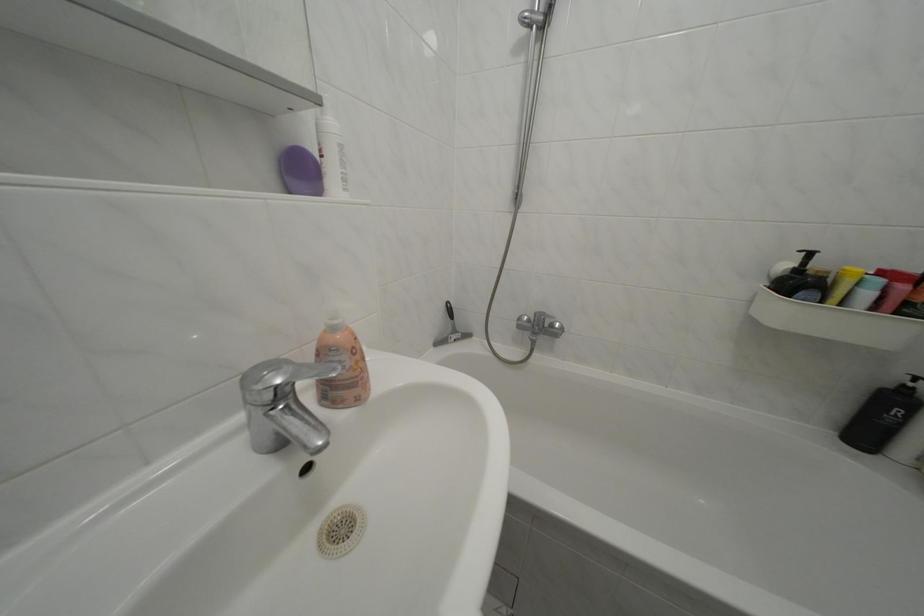
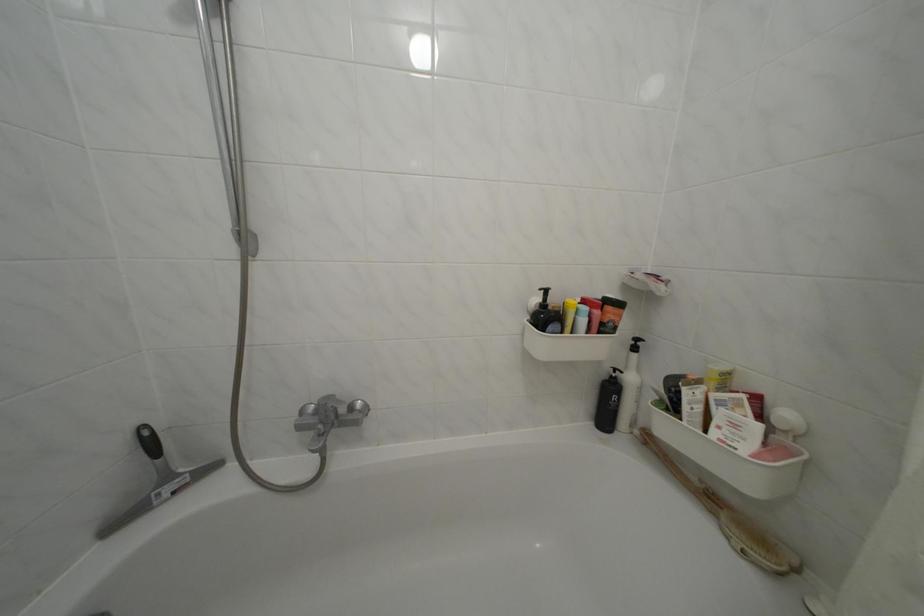
Where in the second image is the point corresponding to (562,331) from the first image?

(359, 414)